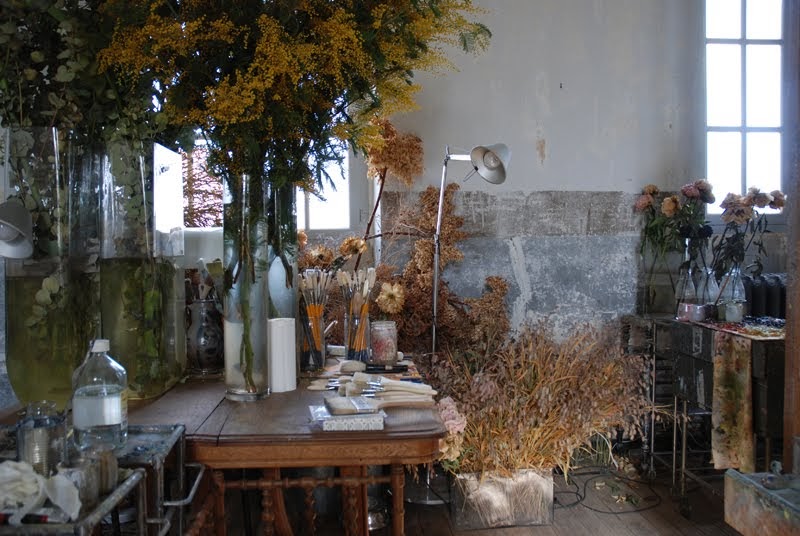
Locate an element on the screen. This screenshot has height=536, width=800. floor is located at coordinates (594, 513), (652, 525).